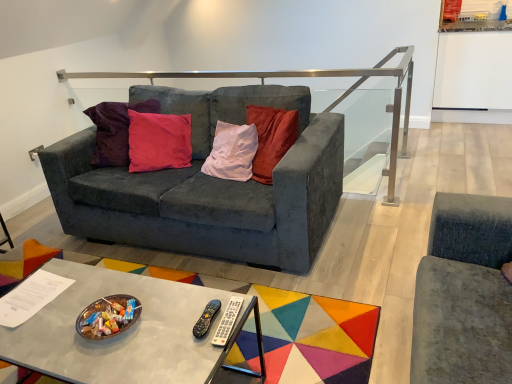
The height and width of the screenshot is (384, 512). Identify the location of free space in front of black plastic remote at center, positioned as the 2th remote in right-to-left order. (185, 357).